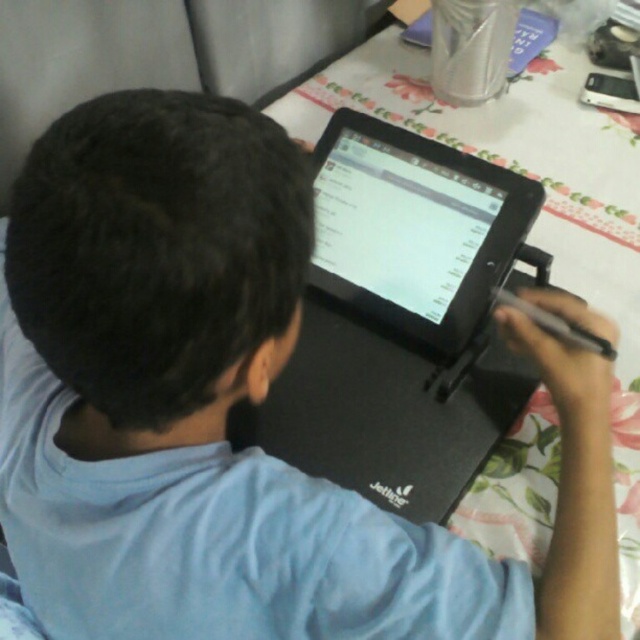
You are setting up a workspace and need to place both the black matte laptop at center and the black glossy tablet at center on a shelf. The shelf has limited vertical space, and you want to ensure that the tallest item is placed at the back to avoid blocking the view of the shorter one. Which device should be placed at the back?

The black matte laptop at center is taller than the black glossy tablet at center, so it should be placed at the back to avoid blocking the view of the black glossy tablet at center.

You are organizing a desk and need to place both the black matte laptop at center and the black glossy tablet at center side by side. Which one should you place on the left to ensure there is enough space for both?

You should place the black glossy tablet at center on the left because it is narrower than the black matte laptop at center, allowing enough space for both when placed side by side.